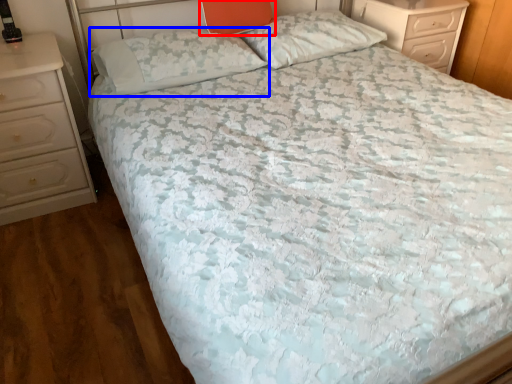
Question: Which object is closer to the camera taking this photo, pillow (highlighted by a red box) or pillow (highlighted by a blue box)?

Choices:
 (A) pillow
 (B) pillow

Answer: (B)